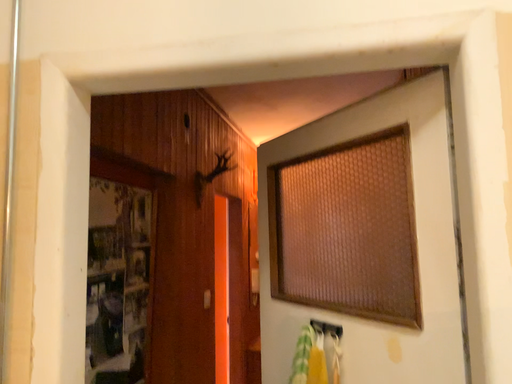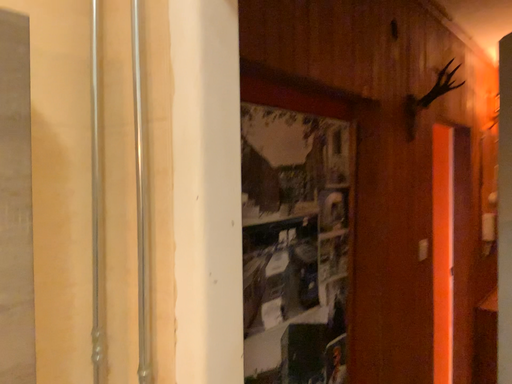
Question: How did the camera likely rotate when shooting the video?

Choices:
 (A) rotated downward
 (B) rotated upward

Answer: (A)